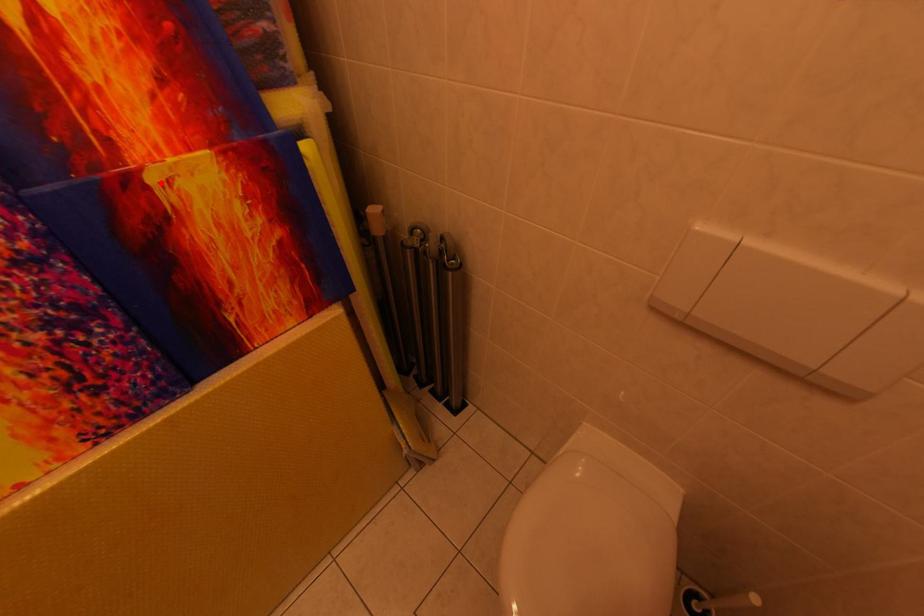
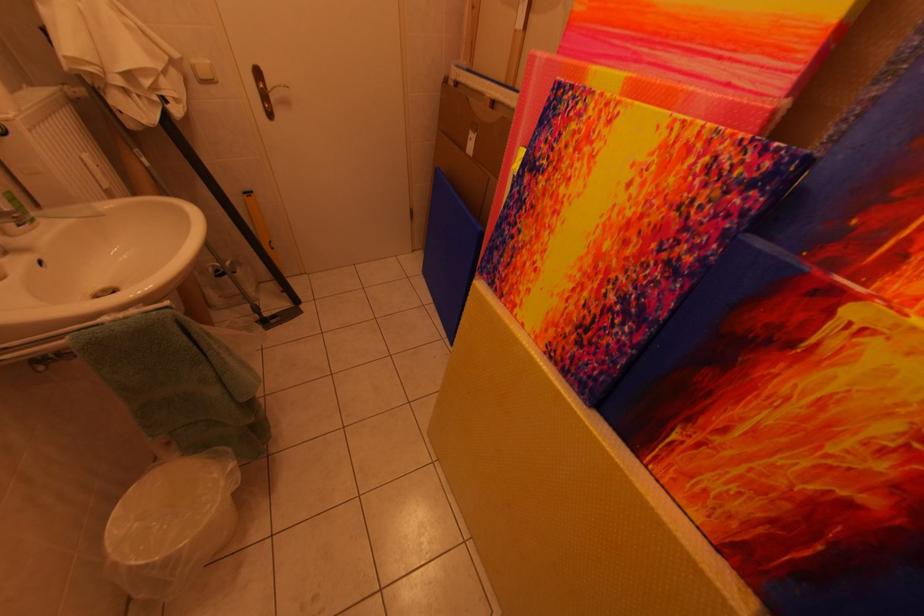
Locate, in the second image, the point that corresponds to the highlighted location in the first image.

(861, 317)